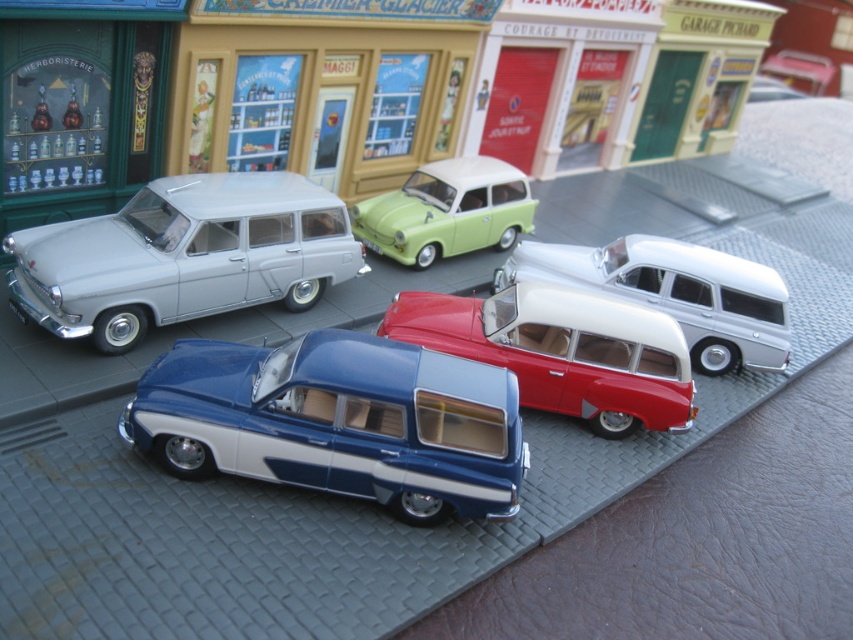
You are a delivery drone that needs to land precisely at the coordinates given for the matte silver station wagon at left. What are the exact coordinates where you should aim to land?

The exact coordinates for the matte silver station wagon at left are at point (183,257).

You are a collector of vintage car models and are examining the miniature diorama. You notice the matte silver station wagon at left and the matte white station wagon at center. Which of these two cars is bigger in size?

The matte silver station wagon at left is larger in size than the matte white station wagon at center.

You are a delivery person trying to access the garage behind the blue metallic station wagon at center and the matte white station wagon at center. Which car should you move to gain access to the garage?

The blue metallic station wagon at center is in front of the matte white station wagon at center, so you should move the blue metallic station wagon at center to access the garage behind them.